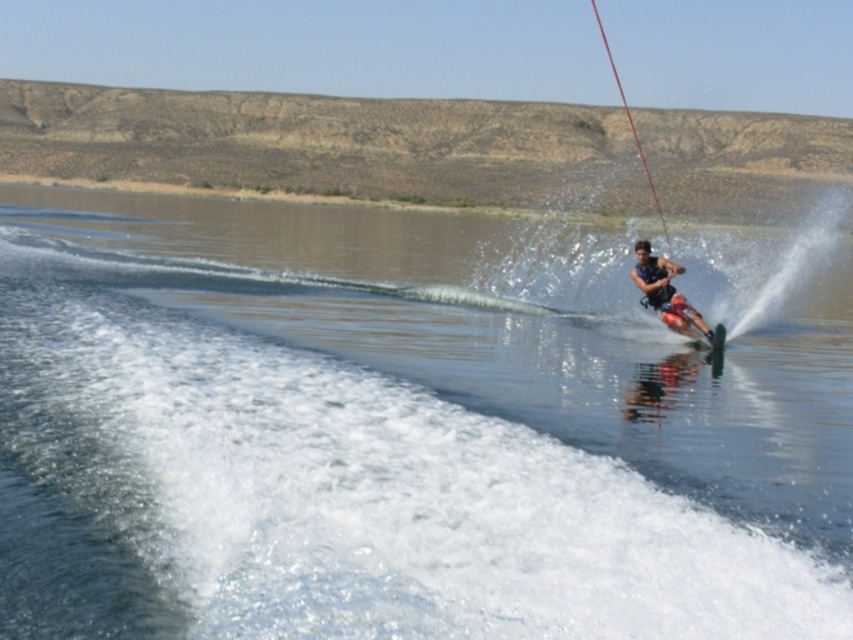
Question: Which point is farther to the camera?

Choices:
 (A) clear water at center
 (B) matte black life vest at center

Answer: (B)

Question: Is clear water at center to the right of matte black life vest at center from the viewer's perspective?

Choices:
 (A) no
 (B) yes

Answer: (A)

Question: Is clear water at center closer to camera compared to matte black life vest at center?

Choices:
 (A) yes
 (B) no

Answer: (A)

Question: Is clear water at center above matte black life vest at center?

Choices:
 (A) no
 (B) yes

Answer: (B)

Question: Which point is closer to the camera taking this photo?

Choices:
 (A) (782, 280)
 (B) (675, 317)

Answer: (B)

Question: Which of the following is the farthest from the observer?

Choices:
 (A) clear water at center
 (B) matte black life vest at center

Answer: (B)